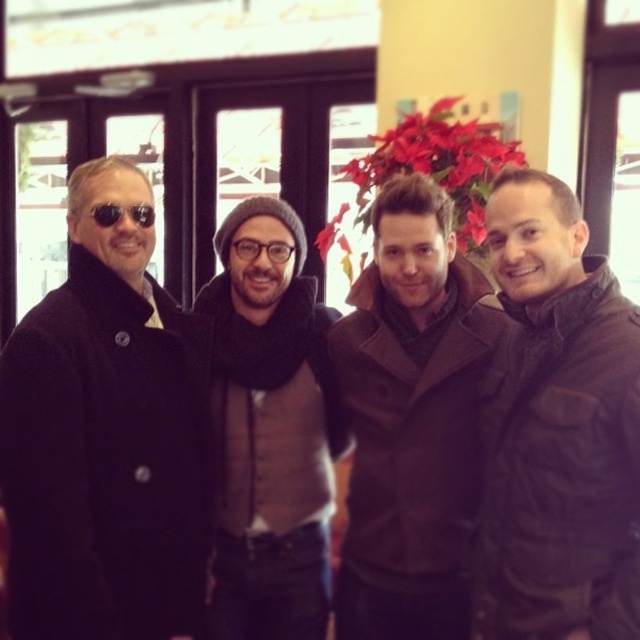
Can you confirm if brown suede vest at center is positioned below red velvet poinsettia at center?

Correct, brown suede vest at center is located below red velvet poinsettia at center.

Between brown suede vest at center and red velvet poinsettia at center, which one is positioned higher?

red velvet poinsettia at center is higher up.

Is point (321, 528) closer to camera compared to point (346, 260)?

Yes, it is in front of point (346, 260).

The height and width of the screenshot is (640, 640). I want to click on brown suede vest at center, so click(x=273, y=444).

Image resolution: width=640 pixels, height=640 pixels. Describe the element at coordinates (436, 164) in the screenshot. I see `red velvet poinsettia at center` at that location.

Can you confirm if red velvet poinsettia at center is thinner than black matte sunglasses at left?

Incorrect, red velvet poinsettia at center's width is not less than black matte sunglasses at left's.

This screenshot has height=640, width=640. Identify the location of red velvet poinsettia at center. (436, 164).

Find the location of a particular element. The height and width of the screenshot is (640, 640). red velvet poinsettia at center is located at coordinates (436, 164).

Between black wool coat at left and red velvet poinsettia at center, which one is positioned lower?

black wool coat at left is lower down.

Where is `black wool coat at left`? black wool coat at left is located at coordinates (104, 438).

You are a GUI agent. You are given a task and a screenshot of the screen. Output one action in this format:
    pyautogui.click(x=<x>, y=<y>)
    Task: Click on the black wool coat at left
    
    Given the screenshot: What is the action you would take?
    pyautogui.click(x=104, y=438)